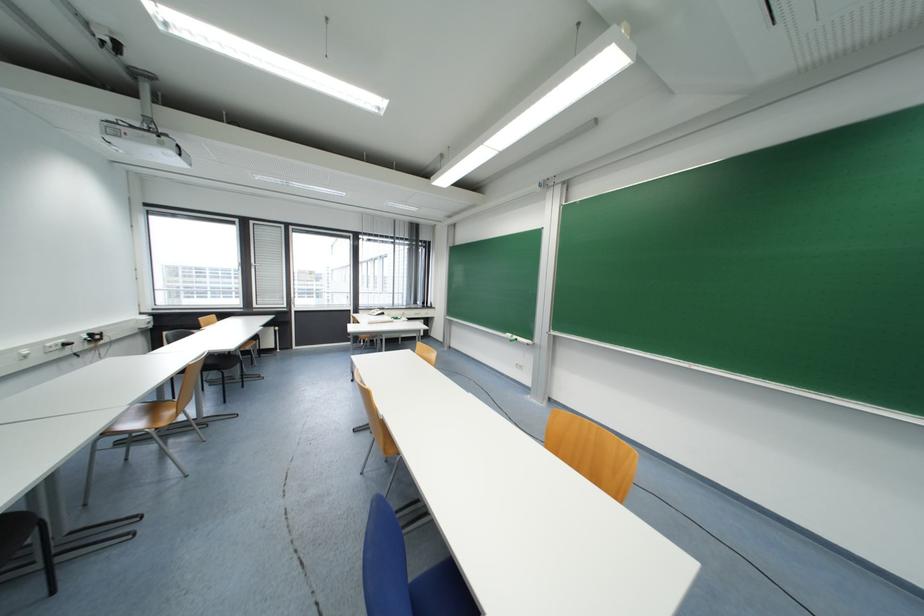
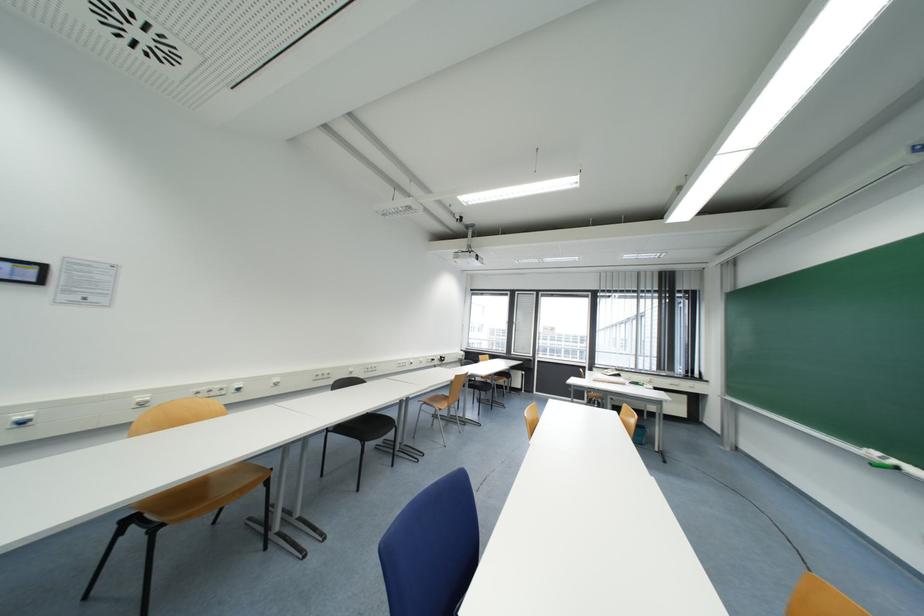
In the second image, find the point that corresponds to point 519,339 in the first image.

(898, 464)